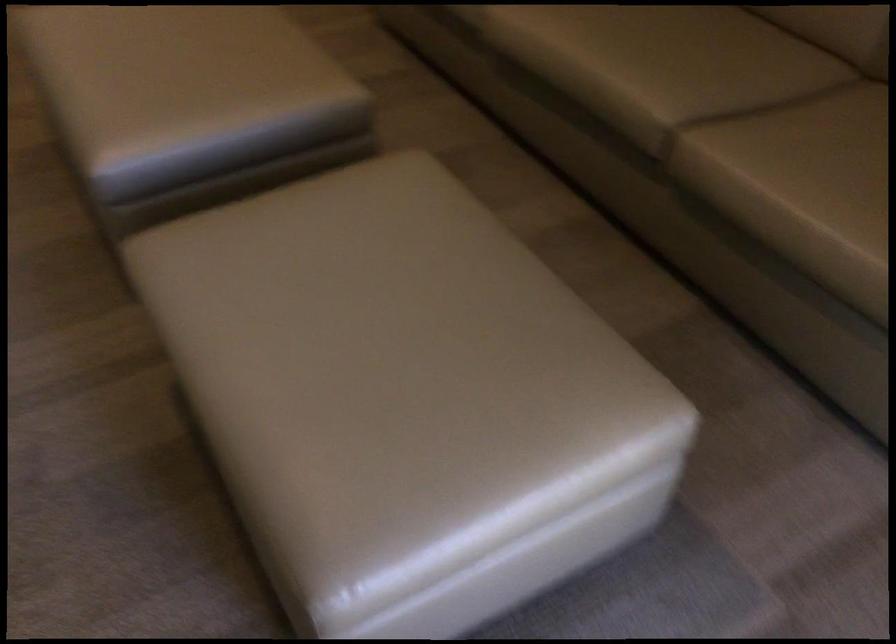
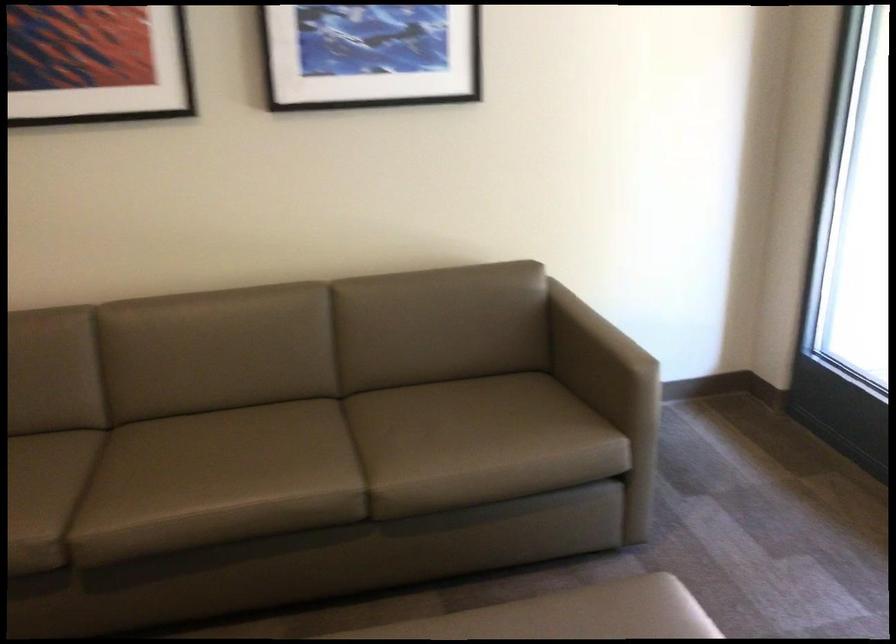
Where in the second image is the point corresponding to the point at 586,351 from the first image?

(597, 618)